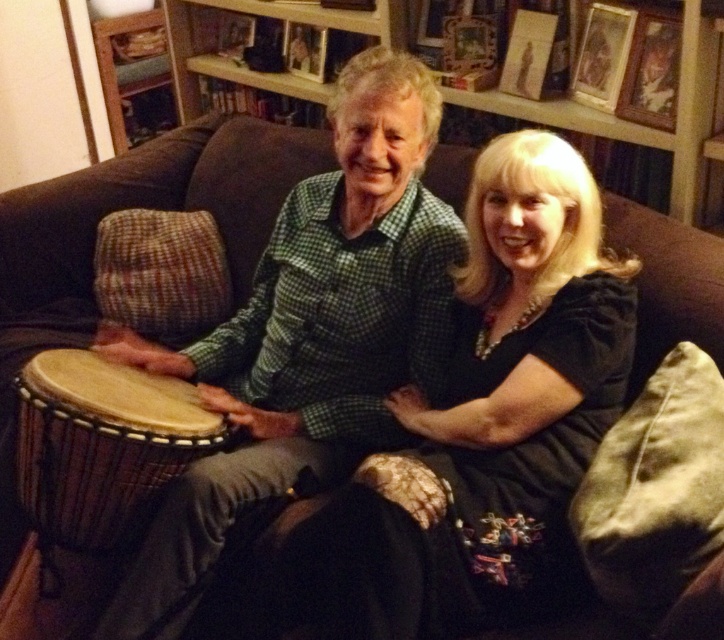
You are trying to place a new decorative item on the shelf behind the natural wood drum at center and the wooden picture frame at upper right. Which object should you avoid placing something to the right of to maintain the current arrangement?

You should avoid placing something to the right of the natural wood drum at center because it is already positioned to the left of the wooden picture frame at upper right, so adding something to its right might disrupt their current spatial relationship.

You are a photographer trying to capture a closeup of the natural wood drum at center. The camera you are using has a focal length of 50mm and you are currently 2 meters away from the drum. To ensure the drum fills the frame, you need to move closer. What is the minimum distance you should stand from the drum to achieve this?

The natural wood drum at center is positioned at point coordinates, so you can move closer to it to fill the frame. However, without specific information about the drum size or camera sensor dimensions, an exact distance cannot be calculated. Adjust your position gradually until the drum occupies the desired portion of the frame.

You are standing in the living room and want to reach the point at coordinates (80,499). If your height is 1.7 meters, will you be able to touch the ceiling?

The point at coordinates (80,499) is 1.43 meters away from the viewer. Since the viewer is 1.7 meters tall, they can easily touch the ceiling as the distance to the point does not relate to the height of the ceiling. However, the given information does not provide details about the ceiling height, so it cannot be determined from the provided data.